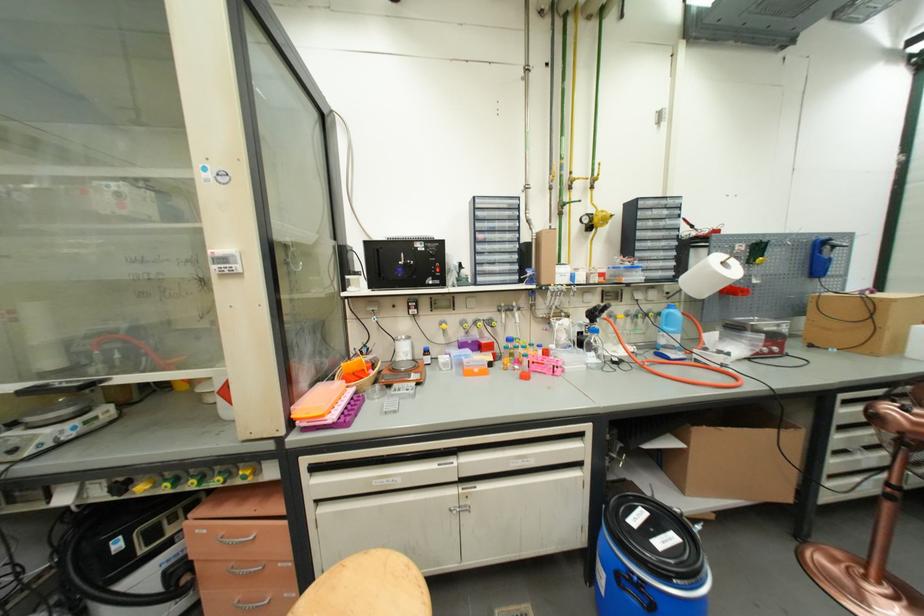
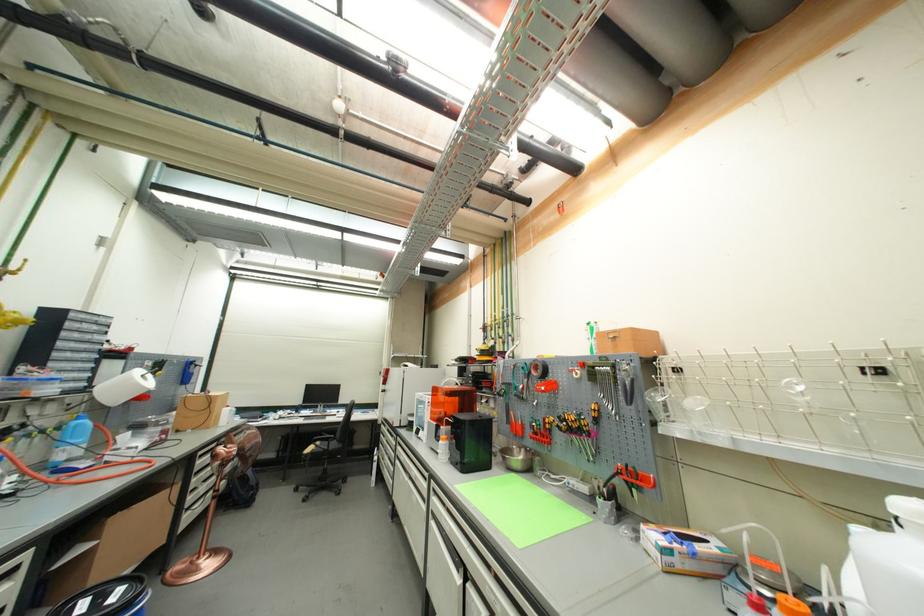
Locate, in the second image, the point that corresponds to point 642,509 in the first image.

(80, 606)